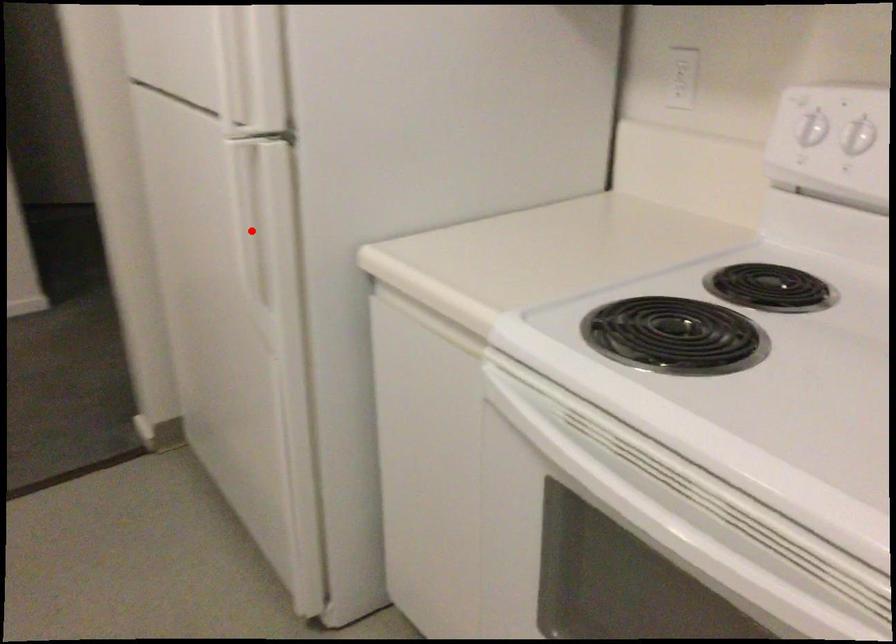
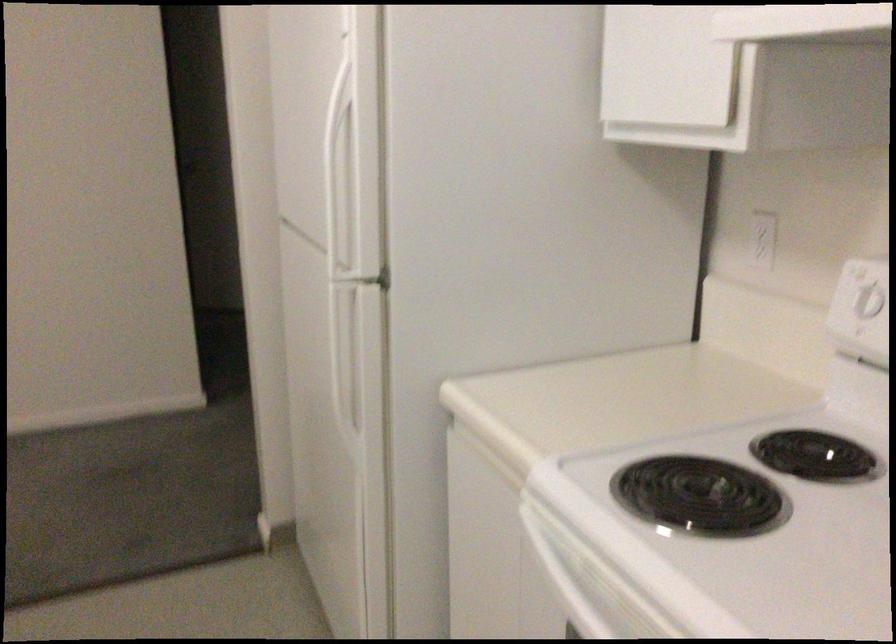
Question: I am providing you with two images of the same scene from different viewpoints. Given a red point in image1, look at the same physical point in image2. Is it:

Choices:
 (A) Closer to the viewpoint
 (B) Farther from the viewpoint

Answer: (B)